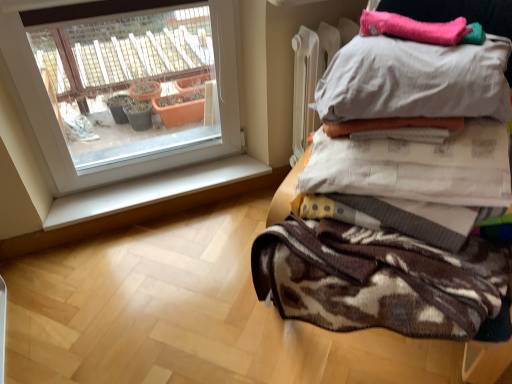
Measure the distance between brown textured blanket at upper right and camera.

brown textured blanket at upper right is 4.42 feet from camera.

What do you see at coordinates (486, 362) in the screenshot? I see `brown textured blanket at upper right` at bounding box center [486, 362].

Image resolution: width=512 pixels, height=384 pixels. What do you see at coordinates (421, 29) in the screenshot? I see `pink fuzzy blanket at upper right, which appears as the second blanket when ordered from the bottom` at bounding box center [421, 29].

This screenshot has height=384, width=512. What do you see at coordinates (379, 280) in the screenshot?
I see `brown textured blanket at right` at bounding box center [379, 280].

This screenshot has width=512, height=384. Find the location of `white smooth window sill at lower left`. white smooth window sill at lower left is located at coordinates (152, 190).

I want to click on brown textured blanket at upper right, so (x=486, y=362).

From the image's perspective, is brown textured blanket at upper right above or below white smooth window sill at lower left?

brown textured blanket at upper right is above white smooth window sill at lower left.

Does brown textured blanket at upper right turn towards white smooth window sill at lower left?

No, brown textured blanket at upper right is not oriented towards white smooth window sill at lower left.

Considering their positions, is brown textured blanket at upper right located in front of or behind white smooth window sill at lower left?

Clearly, brown textured blanket at upper right is in front of white smooth window sill at lower left.

Between brown textured blanket at upper right and white smooth window sill at lower left, which one has larger size?

With larger size is brown textured blanket at upper right.

Consider the image. Is white cotton pillow at upper right positioned with its back to white smooth window sill at lower left?

No, white cotton pillow at upper right's orientation is not away from white smooth window sill at lower left.

From the image's perspective, who appears lower, white cotton pillow at upper right or white smooth window sill at lower left?

white smooth window sill at lower left.

Who is more distant, white cotton pillow at upper right or white smooth window sill at lower left?

white smooth window sill at lower left is more distant.

What's the angular difference between white cotton pillow at upper right and white smooth window sill at lower left's facing directions?

The facing directions of white cotton pillow at upper right and white smooth window sill at lower left are 41.3 degrees apart.

Can you confirm if pink fuzzy blanket at upper right, which appears as the second blanket when ordered from the bottom, is wider than brown textured blanket at upper right, marked as the second blanket in a top-to-bottom arrangement?

Incorrect, the width of pink fuzzy blanket at upper right, which appears as the second blanket when ordered from the bottom, does not surpass that of brown textured blanket at upper right, marked as the second blanket in a top-to-bottom arrangement.

Is pink fuzzy blanket at upper right, which appears as the first blanket when viewed from the top, aimed at brown textured blanket at upper right, positioned as the first blanket in bottom-to-top order?

No, pink fuzzy blanket at upper right, which appears as the first blanket when viewed from the top, is not oriented towards brown textured blanket at upper right, positioned as the first blanket in bottom-to-top order.

Image resolution: width=512 pixels, height=384 pixels. I want to click on blanket above the brown textured blanket at upper right, marked as the second blanket in a top-to-bottom arrangement (from the image's perspective), so click(x=421, y=29).

Identify the location of blanket that is the 1st one when counting backward from the brown textured blanket at upper right. (416, 167).

Is brown textured blanket at upper right thinner than brown textured blanket at upper right, positioned as the first blanket in bottom-to-top order?

No.

From the picture: Considering the relative sizes of brown textured blanket at upper right and brown textured blanket at upper right, positioned as the first blanket in bottom-to-top order, in the image provided, is brown textured blanket at upper right taller than brown textured blanket at upper right, positioned as the first blanket in bottom-to-top order,?

Yes, brown textured blanket at upper right is taller than brown textured blanket at upper right, positioned as the first blanket in bottom-to-top order.

From the picture: Is brown textured blanket at upper right oriented towards brown textured blanket at upper right, positioned as the first blanket in bottom-to-top order?

Yes, brown textured blanket at upper right is oriented towards brown textured blanket at upper right, positioned as the first blanket in bottom-to-top order.

Considering the sizes of brown textured blanket at upper right, positioned as the first blanket in bottom-to-top order, and pink fuzzy blanket at upper right, which appears as the second blanket when ordered from the bottom, in the image, is brown textured blanket at upper right, positioned as the first blanket in bottom-to-top order, taller or shorter than pink fuzzy blanket at upper right, which appears as the second blanket when ordered from the bottom,?

brown textured blanket at upper right, positioned as the first blanket in bottom-to-top order, is taller than pink fuzzy blanket at upper right, which appears as the second blanket when ordered from the bottom.

Considering the sizes of objects brown textured blanket at upper right, positioned as the first blanket in bottom-to-top order, and pink fuzzy blanket at upper right, which appears as the second blanket when ordered from the bottom, in the image provided, who is bigger, brown textured blanket at upper right, positioned as the first blanket in bottom-to-top order, or pink fuzzy blanket at upper right, which appears as the second blanket when ordered from the bottom,?

brown textured blanket at upper right, positioned as the first blanket in bottom-to-top order.

Is brown textured blanket at upper right, positioned as the first blanket in bottom-to-top order, inside or outside of pink fuzzy blanket at upper right, which appears as the first blanket when viewed from the top?

brown textured blanket at upper right, positioned as the first blanket in bottom-to-top order, cannot be found inside pink fuzzy blanket at upper right, which appears as the first blanket when viewed from the top.

From a real-world perspective, which object rests below the other?

white cotton pillow at upper right.

Is pink fuzzy blanket at upper right, which appears as the first blanket when viewed from the top, at the back of white cotton pillow at upper right?

No, pink fuzzy blanket at upper right, which appears as the first blanket when viewed from the top, is not at the back of white cotton pillow at upper right.

The image size is (512, 384). I want to click on pillow located below the pink fuzzy blanket at upper right, which appears as the second blanket when ordered from the bottom (from the image's perspective), so click(x=415, y=80).

Looking at their sizes, would you say white cotton pillow at upper right is wider or thinner than pink fuzzy blanket at upper right, which appears as the second blanket when ordered from the bottom?

white cotton pillow at upper right is wider than pink fuzzy blanket at upper right, which appears as the second blanket when ordered from the bottom.

What's the angular difference between brown textured blanket at upper right, marked as the second blanket in a top-to-bottom arrangement, and brown textured blanket at upper right's facing directions?

16 degrees.

Which of these two, brown textured blanket at upper right, positioned as the first blanket in bottom-to-top order, or brown textured blanket at upper right, stands taller?

With more height is brown textured blanket at upper right.

Does point (508, 183) appear closer or farther from the camera than point (478, 350)?

Clearly, point (508, 183) is closer to the camera than point (478, 350).

Looking at this image, can you confirm if brown textured blanket at upper right, positioned as the first blanket in bottom-to-top order, is positioned to the right of brown textured blanket at upper right?

No, brown textured blanket at upper right, positioned as the first blanket in bottom-to-top order, is not to the right of brown textured blanket at upper right.

Find the location of `window sill that appears below the brown textured blanket at upper right (from a real-world perspective)`. window sill that appears below the brown textured blanket at upper right (from a real-world perspective) is located at coordinates (152, 190).

Identify the location of pillow in front of the white smooth window sill at lower left. The height and width of the screenshot is (384, 512). (415, 80).

In the scene shown: Considering their positions, is white cotton pillow at upper right positioned closer to brown textured blanket at upper right than pink fuzzy blanket at upper right, which appears as the first blanket when viewed from the top?

pink fuzzy blanket at upper right, which appears as the first blanket when viewed from the top, lies closer to brown textured blanket at upper right than the other object.

Based on their spatial positions, is brown textured blanket at upper right or brown textured blanket at right further from white cotton pillow at upper right?

brown textured blanket at upper right.

Estimate the real-world distances between objects in this image. Which object is closer to white cotton pillow at upper right, white smooth window sill at lower left or brown textured blanket at right?

Based on the image, brown textured blanket at right appears to be nearer to white cotton pillow at upper right.

Looking at this image, based on their spatial positions, is white smooth window sill at lower left or brown textured blanket at upper right closer to pink fuzzy blanket at upper right, which appears as the first blanket when viewed from the top?

The object closer to pink fuzzy blanket at upper right, which appears as the first blanket when viewed from the top, is brown textured blanket at upper right.

From the image, which object appears to be farther from brown textured blanket at upper right, marked as the second blanket in a top-to-bottom arrangement, white cotton pillow at upper right or pink fuzzy blanket at upper right, which appears as the second blanket when ordered from the bottom?

Based on the image, pink fuzzy blanket at upper right, which appears as the second blanket when ordered from the bottom, appears to be further to brown textured blanket at upper right, marked as the second blanket in a top-to-bottom arrangement.

Based on their spatial positions, is brown textured blanket at right or white smooth window sill at lower left further from pink fuzzy blanket at upper right, which appears as the second blanket when ordered from the bottom?

white smooth window sill at lower left is further to pink fuzzy blanket at upper right, which appears as the second blanket when ordered from the bottom.

Which object lies further to the anchor point white smooth window sill at lower left, pink fuzzy blanket at upper right, which appears as the second blanket when ordered from the bottom, or brown textured blanket at right?

pink fuzzy blanket at upper right, which appears as the second blanket when ordered from the bottom.

From the image, which object appears to be farther from brown textured blanket at right, pink fuzzy blanket at upper right, which appears as the second blanket when ordered from the bottom, or white smooth window sill at lower left?

white smooth window sill at lower left.

I want to click on pillow between brown textured blanket at upper right and pink fuzzy blanket at upper right, which appears as the second blanket when ordered from the bottom, from front to back, so click(x=415, y=80).

Locate an element on the screen. The height and width of the screenshot is (384, 512). pillow between brown textured blanket at upper right and brown textured blanket at upper right, marked as the second blanket in a top-to-bottom arrangement, along the z-axis is located at coordinates (415, 80).

At what (x,y) coordinates should I click in order to perform the action: click on pillow between pink fuzzy blanket at upper right, which appears as the second blanket when ordered from the bottom, and brown textured blanket at upper right, positioned as the first blanket in bottom-to-top order, in the vertical direction. Please return your answer as a coordinate pair (x, y). Looking at the image, I should click on point(415,80).

This screenshot has width=512, height=384. Find the location of `blanket between pink fuzzy blanket at upper right, which appears as the first blanket when viewed from the top, and brown textured blanket at right from top to bottom`. blanket between pink fuzzy blanket at upper right, which appears as the first blanket when viewed from the top, and brown textured blanket at right from top to bottom is located at coordinates (416, 167).